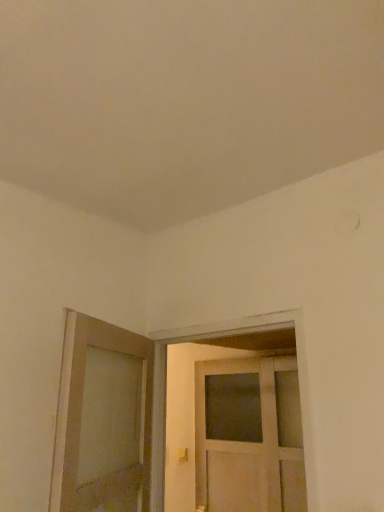
In order to face matte wooden door at left, which is the 1th door in left-to-right order, should I rotate leftwards or rightwards?

To align with it, rotate left about 10.726°.

Find the location of a particular element. Image resolution: width=384 pixels, height=512 pixels. matte gold door handle at lower center is located at coordinates (183, 455).

Image resolution: width=384 pixels, height=512 pixels. I want to click on matte wooden door at left, which is the 1th door in left-to-right order, so click(82, 411).

Consider the image. In terms of size, does white wooden door at center, placed as the second door when sorted from left to right, appear bigger or smaller than matte wooden door at left, which is the second door from right to left?

Considering their sizes, white wooden door at center, placed as the second door when sorted from left to right, takes up less space than matte wooden door at left, which is the second door from right to left.

From a real-world perspective, which object rests below the other?

matte wooden door at left, which is the second door from right to left, is physically lower.

Visually, is white wooden door at center, placed as the second door when sorted from left to right, positioned to the left or to the right of matte wooden door at left, which is the 1th door in left-to-right order?

white wooden door at center, placed as the second door when sorted from left to right, is positioned on matte wooden door at left, which is the 1th door in left-to-right order,'s right side.

Is there a large distance between white wooden door at center, placed as the second door when sorted from left to right, and matte wooden door at left, which is the 1th door in left-to-right order?

white wooden door at center, placed as the second door when sorted from left to right, is actually quite close to matte wooden door at left, which is the 1th door in left-to-right order.

Is matte wooden door at left, which is the 1th door in left-to-right order, closer to camera compared to matte gold door handle at lower center?

Yes.

Considering the relative sizes of matte wooden door at left, which is the 1th door in left-to-right order, and matte gold door handle at lower center in the image provided, is matte wooden door at left, which is the 1th door in left-to-right order, taller than matte gold door handle at lower center?

Yes.

From the image's perspective, which object appears higher, matte wooden door at left, which is the second door from right to left, or matte gold door handle at lower center?

matte wooden door at left, which is the second door from right to left.

Measure the distance from matte wooden door at left, which is the second door from right to left, to matte gold door handle at lower center.

A distance of 1.54 meters exists between matte wooden door at left, which is the second door from right to left, and matte gold door handle at lower center.

Visually, is matte wooden door at left, which is the second door from right to left, positioned to the left or to the right of white wooden door at center, the first door in the right-to-left sequence?

Based on their positions, matte wooden door at left, which is the second door from right to left, is located to the left of white wooden door at center, the first door in the right-to-left sequence.

Is matte wooden door at left, which is the 1th door in left-to-right order, oriented towards white wooden door at center, the first door in the right-to-left sequence?

Yes, matte wooden door at left, which is the 1th door in left-to-right order, is turned towards white wooden door at center, the first door in the right-to-left sequence.

From the image's perspective, between matte wooden door at left, which is the 1th door in left-to-right order, and white wooden door at center, placed as the second door when sorted from left to right, who is located below?

white wooden door at center, placed as the second door when sorted from left to right.

Is point (79, 367) closer or farther from the camera than point (104, 338)?

Point (79, 367) is positioned closer to the camera compared to point (104, 338).

From a real-world perspective, is matte gold door handle at lower center located higher than matte wooden door at left, which is the 1th door in left-to-right order?

No.

Does matte gold door handle at lower center have a greater height compared to matte wooden door at left, which is the second door from right to left?

No.

From the image's perspective, is matte gold door handle at lower center located above or below matte wooden door at left, which is the 1th door in left-to-right order?

Based on their image positions, matte gold door handle at lower center is located beneath matte wooden door at left, which is the 1th door in left-to-right order.

Looking at their sizes, would you say matte gold door handle at lower center is wider or thinner than matte wooden door at left, which is the 1th door in left-to-right order?

In the image, matte gold door handle at lower center appears to be more narrow than matte wooden door at left, which is the 1th door in left-to-right order.

Considering the points (192, 336) and (181, 452), which point is behind, point (192, 336) or point (181, 452)?

The point (181, 452) is farther.

Find the location of a particular element. door handle lying below the white wooden door at center, placed as the second door when sorted from left to right (from the image's perspective) is located at coordinates (183, 455).

From the image's perspective, is white wooden door at center, the first door in the right-to-left sequence, below matte gold door handle at lower center?

Incorrect, from the image's perspective, white wooden door at center, the first door in the right-to-left sequence, is higher than matte gold door handle at lower center.

From a real-world perspective, which object stands above the other?

white wooden door at center, the first door in the right-to-left sequence.

Is matte gold door handle at lower center far from white wooden door at center, the first door in the right-to-left sequence?

Yes, matte gold door handle at lower center is far from white wooden door at center, the first door in the right-to-left sequence.

Consider the image. Is matte gold door handle at lower center wider or thinner than white wooden door at center, the first door in the right-to-left sequence?

Considering their sizes, matte gold door handle at lower center looks slimmer than white wooden door at center, the first door in the right-to-left sequence.

Is matte gold door handle at lower center positioned with its back to white wooden door at center, placed as the second door when sorted from left to right?

No, matte gold door handle at lower center's orientation is not away from white wooden door at center, placed as the second door when sorted from left to right.

Considering the relative positions of matte gold door handle at lower center and white wooden door at center, placed as the second door when sorted from left to right, in the image provided, is matte gold door handle at lower center to the left or to the right of white wooden door at center, placed as the second door when sorted from left to right,?

matte gold door handle at lower center is to the left of white wooden door at center, placed as the second door when sorted from left to right.

The width and height of the screenshot is (384, 512). What are the coordinates of `door below the white wooden door at center, placed as the second door when sorted from left to right (from a real-world perspective)` in the screenshot? It's located at (82, 411).

At what (x,y) coordinates should I click in order to perform the action: click on door handle that appears on the right of matte wooden door at left, which is the 1th door in left-to-right order. Please return your answer as a coordinate pair (x, y). Looking at the image, I should click on (183, 455).

From the image, which object appears to be farther from white wooden door at center, the first door in the right-to-left sequence, matte gold door handle at lower center or matte wooden door at left, which is the 1th door in left-to-right order?

matte gold door handle at lower center.

Looking at the image, which one is located closer to matte wooden door at left, which is the 1th door in left-to-right order, matte gold door handle at lower center or white wooden door at center, placed as the second door when sorted from left to right?

white wooden door at center, placed as the second door when sorted from left to right, lies closer to matte wooden door at left, which is the 1th door in left-to-right order, than the other object.

From the image, which object appears to be nearer to white wooden door at center, the first door in the right-to-left sequence, matte wooden door at left, which is the second door from right to left, or matte gold door handle at lower center?

matte wooden door at left, which is the second door from right to left, is closer to white wooden door at center, the first door in the right-to-left sequence.

Based on their spatial positions, is matte wooden door at left, which is the second door from right to left, or white wooden door at center, the first door in the right-to-left sequence, closer to matte gold door handle at lower center?

white wooden door at center, the first door in the right-to-left sequence, is closer to matte gold door handle at lower center.

Which object lies nearer to the anchor point matte wooden door at left, which is the second door from right to left, white wooden door at center, placed as the second door when sorted from left to right, or matte gold door handle at lower center?

white wooden door at center, placed as the second door when sorted from left to right, is positioned closer to the anchor matte wooden door at left, which is the second door from right to left.

From the image, which object appears to be nearer to matte gold door handle at lower center, white wooden door at center, placed as the second door when sorted from left to right, or matte wooden door at left, which is the 1th door in left-to-right order?

white wooden door at center, placed as the second door when sorted from left to right, is positioned closer to the anchor matte gold door handle at lower center.

Find the location of a particular element. door positioned between matte wooden door at left, which is the 1th door in left-to-right order, and matte gold door handle at lower center from near to far is located at coordinates (152, 390).